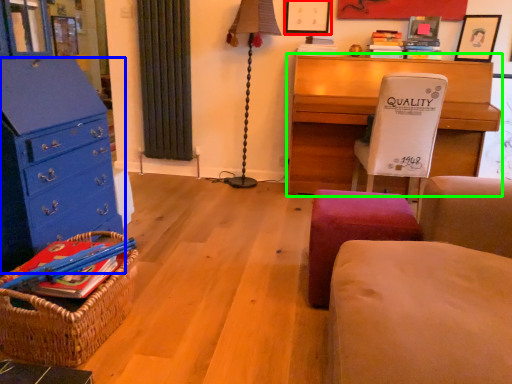
Question: Which object is the farthest from picture frame (highlighted by a red box)? Choose among these: chest of drawers (highlighted by a blue box) or desk (highlighted by a green box).

Choices:
 (A) chest of drawers
 (B) desk

Answer: (A)